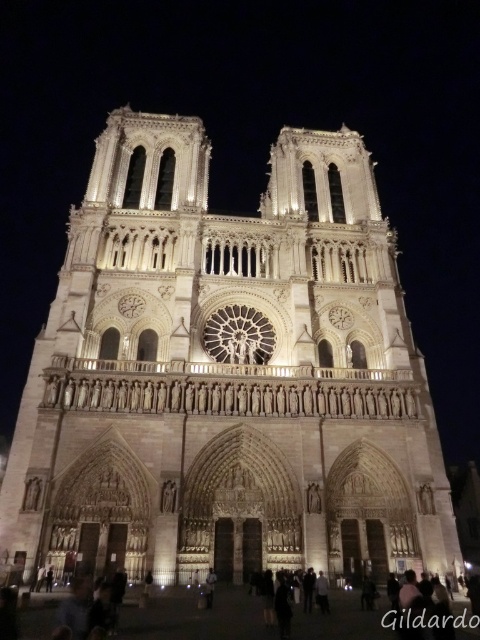
Question: Is the position of light beige stone tower at center less distant than that of dark skin textured person at lower center?

Choices:
 (A) yes
 (B) no

Answer: (B)

Question: Is light beige stone tower at center thinner than dark skin textured person at lower center?

Choices:
 (A) no
 (B) yes

Answer: (A)

Question: Which of the following is the closest to the observer?

Choices:
 (A) (177, 604)
 (B) (283, 436)

Answer: (A)

Question: Which of the following is the closest to the observer?

Choices:
 (A) (8, 509)
 (B) (41, 628)

Answer: (B)

Question: Is light beige stone tower at center wider than dark skin textured person at lower center?

Choices:
 (A) no
 (B) yes

Answer: (B)